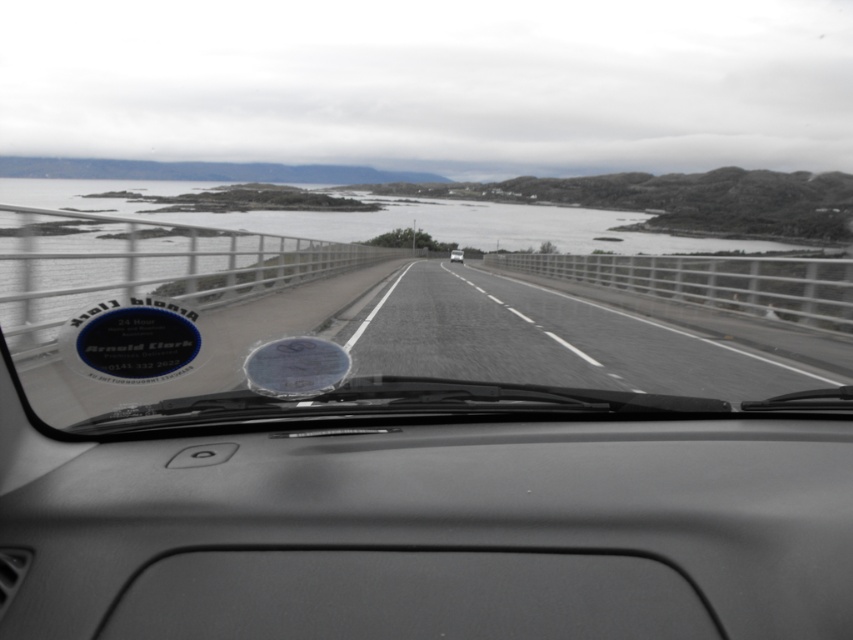
Question: Which object appears closest to the camera in this image?

Choices:
 (A) matte gray dashboard at center
 (B) white glossy car at center
 (C) transparent glass windshield at center

Answer: (A)

Question: Can you confirm if matte gray dashboard at center is thinner than transparent glass windshield at center?

Choices:
 (A) yes
 (B) no

Answer: (A)

Question: Is transparent glass windshield at center to the left of white glossy car at center from the viewer's perspective?

Choices:
 (A) no
 (B) yes

Answer: (B)

Question: Which point is closer to the camera?

Choices:
 (A) (785, 529)
 (B) (36, 376)

Answer: (A)

Question: Which point appears closest to the camera in this image?

Choices:
 (A) (454, 256)
 (B) (341, 534)

Answer: (B)

Question: Is transparent glass windshield at center wider than white glossy car at center?

Choices:
 (A) no
 (B) yes

Answer: (B)